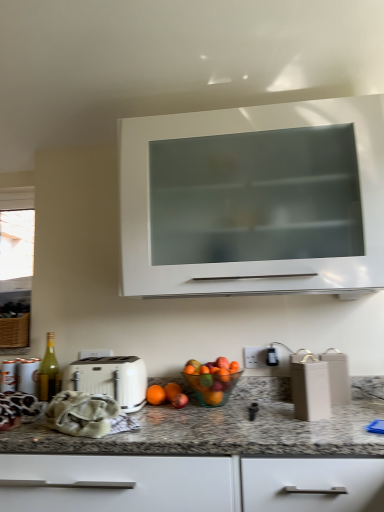
Question: Should I look upward or downward to see green glass bottle at left?

Choices:
 (A) down
 (B) up

Answer: (A)

Question: Can you confirm if white matte toaster at center is taller than green glass bottle at left?

Choices:
 (A) yes
 (B) no

Answer: (B)

Question: Is white matte toaster at center beside green glass bottle at left?

Choices:
 (A) yes
 (B) no

Answer: (B)

Question: From the image's perspective, is white matte toaster at center under green glass bottle at left?

Choices:
 (A) no
 (B) yes

Answer: (B)

Question: Is white matte toaster at center looking in the opposite direction of green glass bottle at left?

Choices:
 (A) yes
 (B) no

Answer: (B)

Question: Does white matte toaster at center lie behind green glass bottle at left?

Choices:
 (A) yes
 (B) no

Answer: (B)

Question: Is white matte toaster at center wider than green glass bottle at left?

Choices:
 (A) no
 (B) yes

Answer: (B)

Question: From a real-world perspective, is white matte toaster at center located beneath orange matte at center?

Choices:
 (A) no
 (B) yes

Answer: (A)

Question: From the image's perspective, is white matte toaster at center below orange matte at center?

Choices:
 (A) yes
 (B) no

Answer: (B)

Question: Can you confirm if white matte toaster at center is bigger than orange matte at center?

Choices:
 (A) yes
 (B) no

Answer: (A)

Question: Is white matte toaster at center in front of orange matte at center?

Choices:
 (A) no
 (B) yes

Answer: (B)

Question: Considering the relative sizes of white matte toaster at center and orange matte at center in the image provided, is white matte toaster at center wider than orange matte at center?

Choices:
 (A) yes
 (B) no

Answer: (A)

Question: Is white matte toaster at center outside orange matte at center?

Choices:
 (A) no
 (B) yes

Answer: (B)

Question: From a real-world perspective, is green glass bottle at left over granite at lower center?

Choices:
 (A) yes
 (B) no

Answer: (A)